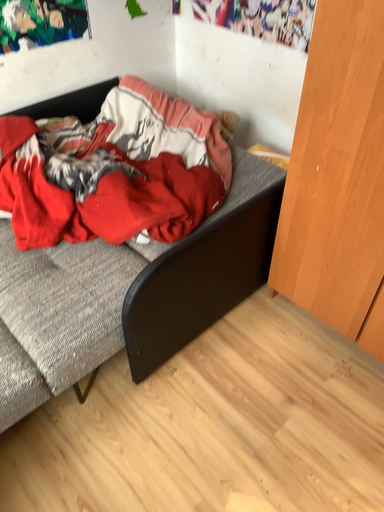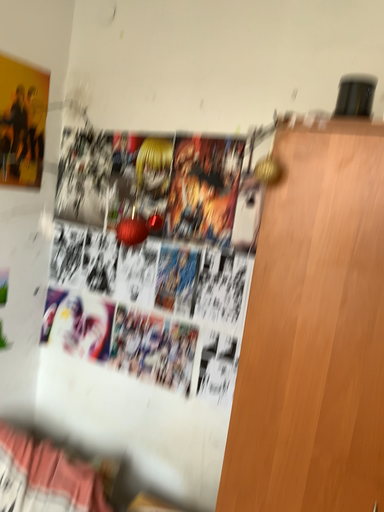
Question: How did the camera likely rotate when shooting the video?

Choices:
 (A) rotated upward
 (B) rotated downward

Answer: (A)